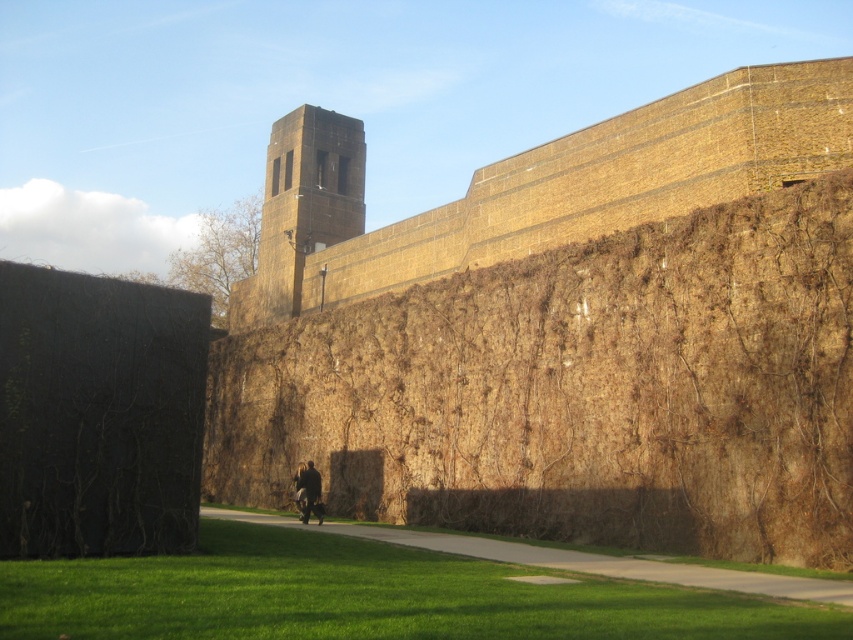
Question: Does brown textured hedge at center have a smaller size compared to green grass at lower center?

Choices:
 (A) no
 (B) yes

Answer: (A)

Question: Does brown textured hedge at center have a smaller size compared to green grass at lower center?

Choices:
 (A) no
 (B) yes

Answer: (A)

Question: Which point is closer to the camera?

Choices:
 (A) black textured hedge at left
 (B) dark brown leather jacket at center
 (C) green grass at lower center

Answer: (C)

Question: Estimate the real-world distances between objects in this image. Which object is closer to the dark brown leather jacket at center?

Choices:
 (A) brown textured hedge at center
 (B) green grass at lower center

Answer: (A)

Question: Among these points, which one is nearest to the camera?

Choices:
 (A) (730, 376)
 (B) (80, 458)

Answer: (B)

Question: Is black textured hedge at left positioned behind dark brown leather jacket at center?

Choices:
 (A) yes
 (B) no

Answer: (B)